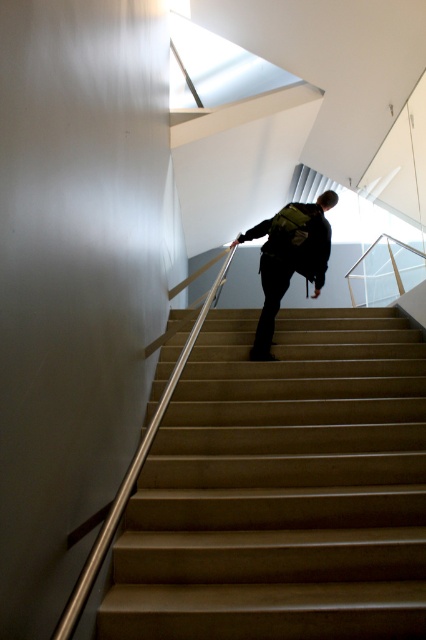
Between smooth beige stairs at center and black matte backpack at center, which one is positioned higher?

black matte backpack at center is above.

Between point (201, 388) and point (278, 296), which one is positioned in front?

Point (201, 388) is more forward.

Is point (379, 609) farther from viewer compared to point (298, 205)?

No, it is not.

Where is `smooth beige stairs at center`? smooth beige stairs at center is located at coordinates (282, 488).